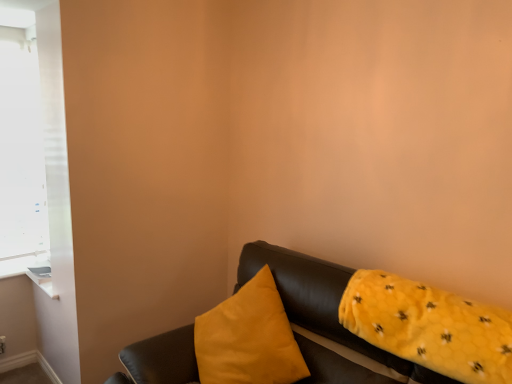
Question: Considering the relative sizes of yellow fuzzy pillow at right, the 1th pillow in the right-to-left sequence, and leather couch at lower right in the image provided, is yellow fuzzy pillow at right, the 1th pillow in the right-to-left sequence, smaller than leather couch at lower right?

Choices:
 (A) no
 (B) yes

Answer: (B)

Question: Would you say leather couch at lower right is part of yellow fuzzy pillow at right, the 1th pillow in the right-to-left sequence,'s contents?

Choices:
 (A) yes
 (B) no

Answer: (B)

Question: Considering the relative positions of yellow fuzzy pillow at right, the 1th pillow in the right-to-left sequence, and leather couch at lower right in the image provided, is yellow fuzzy pillow at right, the 1th pillow in the right-to-left sequence, to the right of leather couch at lower right from the viewer's perspective?

Choices:
 (A) yes
 (B) no

Answer: (A)

Question: Does yellow fuzzy pillow at right, arranged as the second pillow when viewed from the left, turn towards leather couch at lower right?

Choices:
 (A) yes
 (B) no

Answer: (A)

Question: Does yellow fuzzy pillow at right, the 1th pillow in the right-to-left sequence, come in front of leather couch at lower right?

Choices:
 (A) no
 (B) yes

Answer: (A)

Question: From a real-world perspective, is yellow fuzzy pillow at right, arranged as the second pillow when viewed from the left, positioned above or below white matte window at upper left?

Choices:
 (A) above
 (B) below

Answer: (B)

Question: Is yellow fuzzy pillow at right, arranged as the second pillow when viewed from the left, in front of or behind white matte window at upper left in the image?

Choices:
 (A) behind
 (B) front

Answer: (B)

Question: Is point (399, 317) positioned closer to the camera than point (25, 208)?

Choices:
 (A) farther
 (B) closer

Answer: (B)

Question: From the image's perspective, is yellow fuzzy pillow at right, the 1th pillow in the right-to-left sequence, located above or below white matte window at upper left?

Choices:
 (A) below
 (B) above

Answer: (A)

Question: Is leather couch at lower right bigger or smaller than matte yellow pillow at center, the second pillow positioned from the right?

Choices:
 (A) small
 (B) big

Answer: (B)

Question: From the image's perspective, is leather couch at lower right above or below matte yellow pillow at center, the first pillow positioned from the left?

Choices:
 (A) above
 (B) below

Answer: (B)

Question: Would you say leather couch at lower right is inside or outside matte yellow pillow at center, the second pillow positioned from the right?

Choices:
 (A) inside
 (B) outside

Answer: (B)

Question: From a real-world perspective, relative to matte yellow pillow at center, the first pillow positioned from the left, is leather couch at lower right vertically above or below?

Choices:
 (A) below
 (B) above

Answer: (A)

Question: Is white matte window at upper left wider or thinner than leather couch at lower right?

Choices:
 (A) thin
 (B) wide

Answer: (A)

Question: Considering the positions of point (22, 210) and point (248, 278), is point (22, 210) closer or farther from the camera than point (248, 278)?

Choices:
 (A) closer
 (B) farther

Answer: (B)